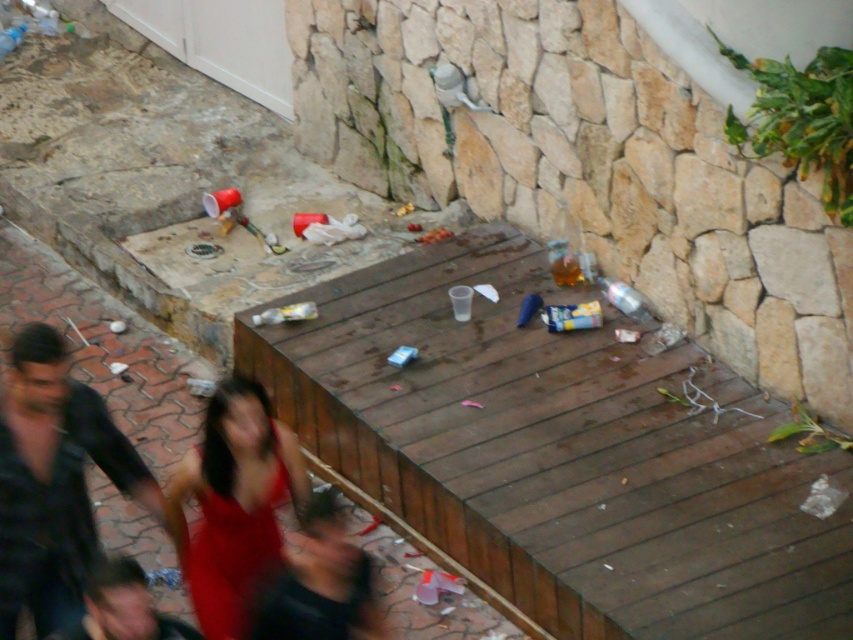
You are a photographer trying to capture a clear shot of the red satin dress at lower center and the smooth black shirt at lower left. Given that your camera has a minimum focus distance of 14 inches, will you be able to focus on both subjects simultaneously?

The red satin dress at lower center and smooth black shirt at lower left are 13.74 inches apart, which is less than the camera minimum focus distance of 14 inches. Therefore, the camera cannot focus on both subjects simultaneously.

You are a photographer trying to capture the red satin dress at lower center. Where exactly should you position your camera to ensure the dress is in the frame?

Position your camera at point (233, 502) to capture the red satin dress at lower center.